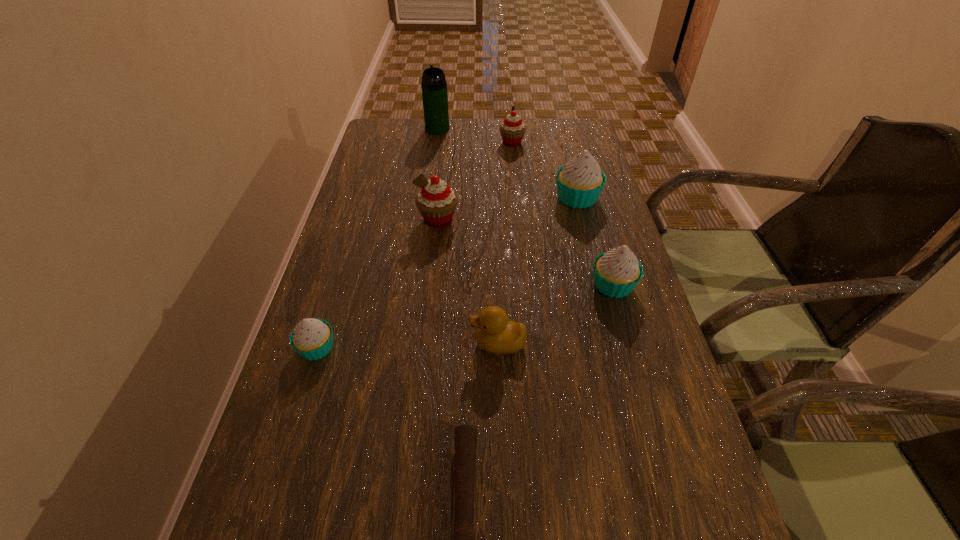
At what (x,y) coordinates should I click in order to perform the action: click on the farthest object. Please return your answer as a coordinate pair (x, y). This screenshot has width=960, height=540. Looking at the image, I should click on (434, 86).

You are a GUI agent. You are given a task and a screenshot of the screen. Output one action in this format:
    pyautogui.click(x=<x>, y=<y>)
    Task: Click on the tallest object
    
    Given the screenshot: What is the action you would take?
    pyautogui.click(x=434, y=86)

Where is `the left pink cupcake`? Image resolution: width=960 pixels, height=540 pixels. the left pink cupcake is located at coordinates (436, 201).

At what (x,y) coordinates should I click in order to perform the action: click on the nearer pink cupcake. Please return your answer as a coordinate pair (x, y). Image resolution: width=960 pixels, height=540 pixels. Looking at the image, I should click on (436, 201).

This screenshot has height=540, width=960. I want to click on the farthest white cupcake, so click(x=579, y=183).

Identify the location of the smaller pink cupcake. The width and height of the screenshot is (960, 540). pos(512,129).

Where is `the right pink cupcake`? The height and width of the screenshot is (540, 960). the right pink cupcake is located at coordinates 512,129.

Identify the location of the second nearest white cupcake. The height and width of the screenshot is (540, 960). (617, 272).

What are the coordinates of `the second smallest white cupcake` in the screenshot? It's located at (617, 272).

This screenshot has height=540, width=960. I want to click on duckling, so click(x=496, y=334).